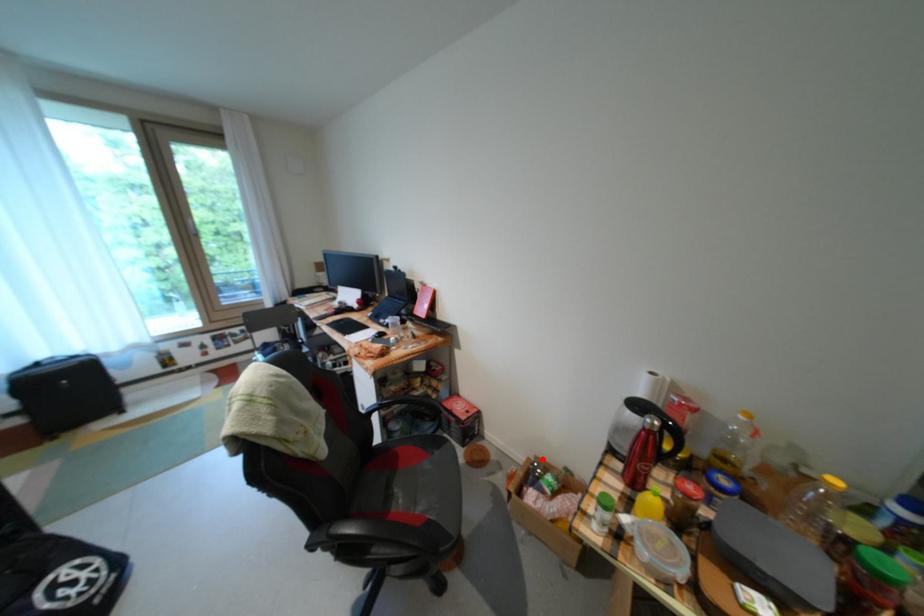
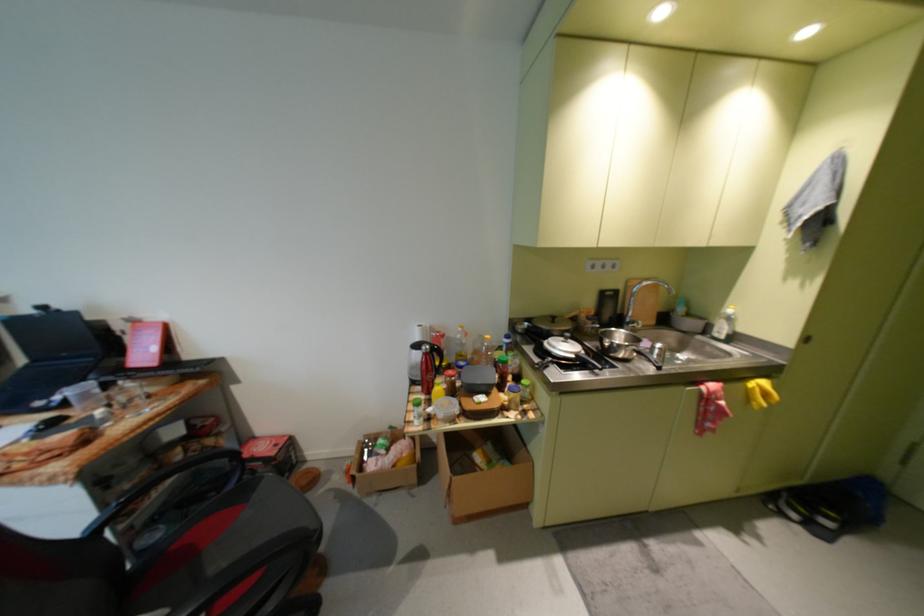
Question: I am providing you with two images of the same scene from different viewpoints. Given a red point in image1, look at the same physical point in image2. Is it:

Choices:
 (A) Closer to the viewpoint
 (B) Farther from the viewpoint

Answer: (B)